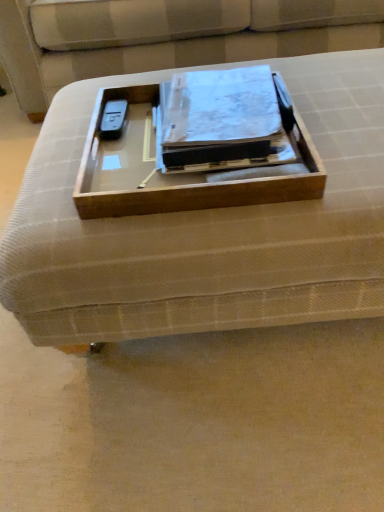
Identify the location of empty space that is ontop of wooden tray at center (from a real-world perspective). This screenshot has width=384, height=512. (291, 98).